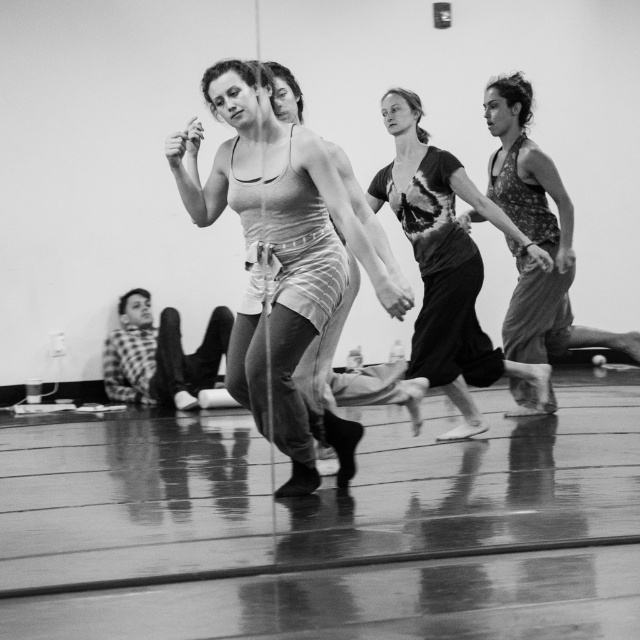
You are a photographer standing in the studio and want to capture a photo of the dance class. Your camera is set to focus at 7 meters. Is the point at point [529,355] within the focus range of your camera?

The distance of point [529,355] from the camera is 7.05 meters, which is just beyond the camera focus set at 7 meters. Therefore, the point at point [529,355] may not be in focus.

You are a costume designer preparing for a dance performance. You have two outfits to choose from in the image. The first is the patterned fabric tank top at right, and the second is the checkered fabric shirt at lower left. Based on their sizes, which outfit would be more suitable for a dancer who needs to move freely?

The patterned fabric tank top at right has a larger size compared to the checkered fabric shirt at lower left, making it more suitable for a dancer needing to move freely as it provides more room and flexibility.